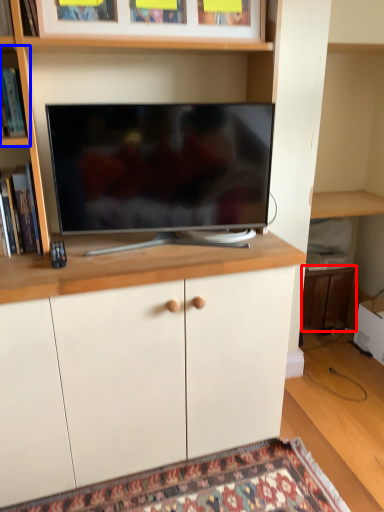
Question: Which of the following is the farthest to the observer, cabinetry (highlighted by a red box) or shelf (highlighted by a blue box)?

Choices:
 (A) cabinetry
 (B) shelf

Answer: (A)